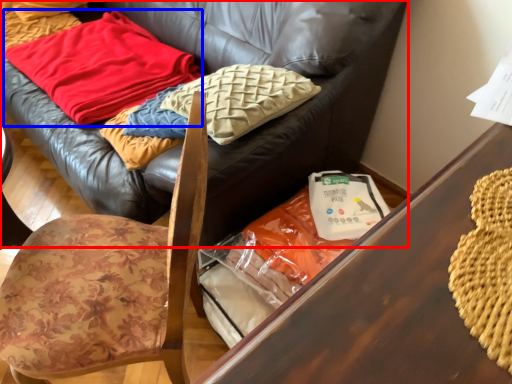
Question: Which point is closer to the camera, studio couch (highlighted by a red box) or blanket (highlighted by a blue box)?

Choices:
 (A) studio couch
 (B) blanket

Answer: (A)